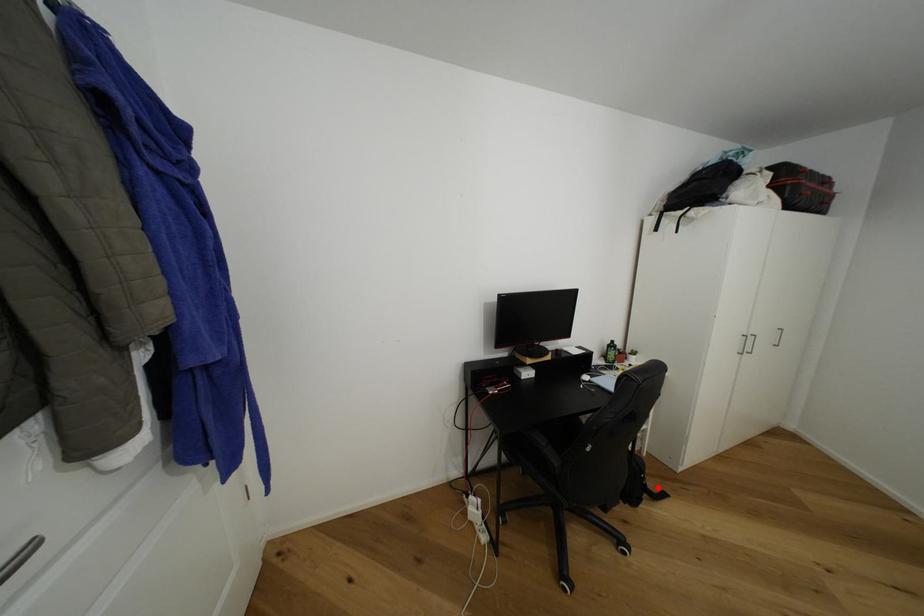
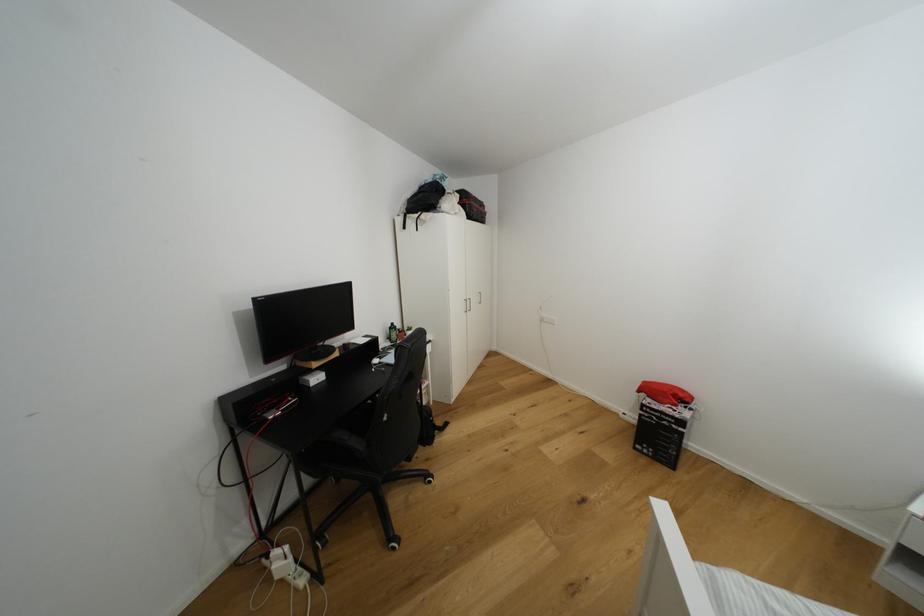
Question: A red point is marked in image1. In image2, is the corresponding 3D point closer to the camera or farther? Reply with the corresponding letter.

Choices:
 (A) The corresponding 3D point is closer.
 (B) The corresponding 3D point is farther.

Answer: (A)